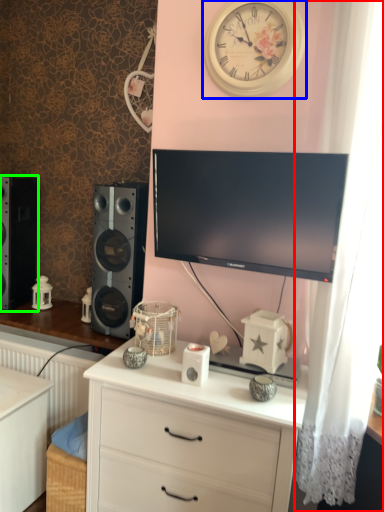
Question: Based on their relative distances, which object is nearer to curtain (highlighted by a red box)? Choose from wall clock (highlighted by a blue box) and speaker (highlighted by a green box).

Choices:
 (A) wall clock
 (B) speaker

Answer: (A)